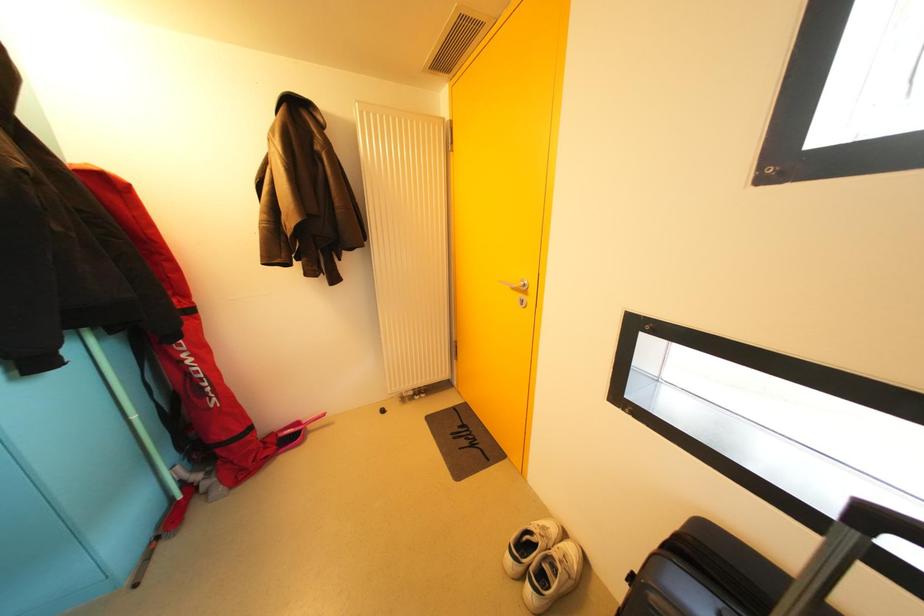
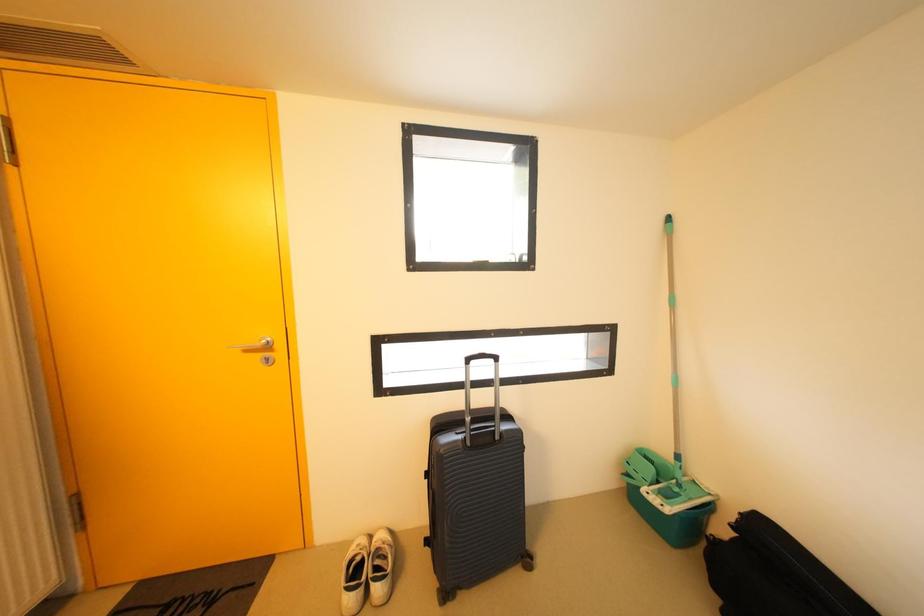
Question: The camera is either moving clockwise (left) or counter-clockwise (right) around the object. The first image is from the beginning of the video and the second image is from the end. Is the camera moving left or right when shooting the video?

Choices:
 (A) Left
 (B) Right

Answer: (A)